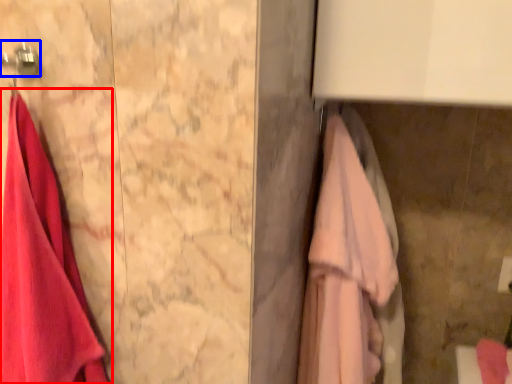
Question: Which of the following is the closest to the observer, towel (highlighted by a red box) or hanger (highlighted by a blue box)?

Choices:
 (A) towel
 (B) hanger

Answer: (A)